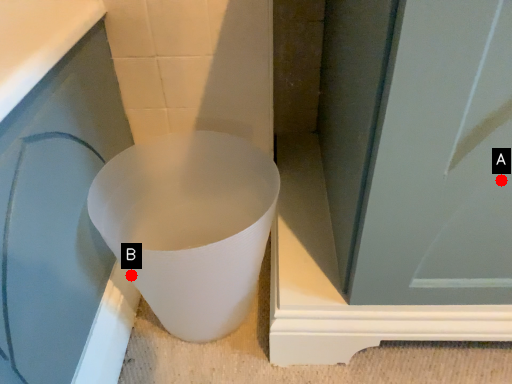
Question: Two points are circled on the image, labeled by A and B beside each circle. Which point is closer to the camera?

Choices:
 (A) A is closer
 (B) B is closer

Answer: (A)